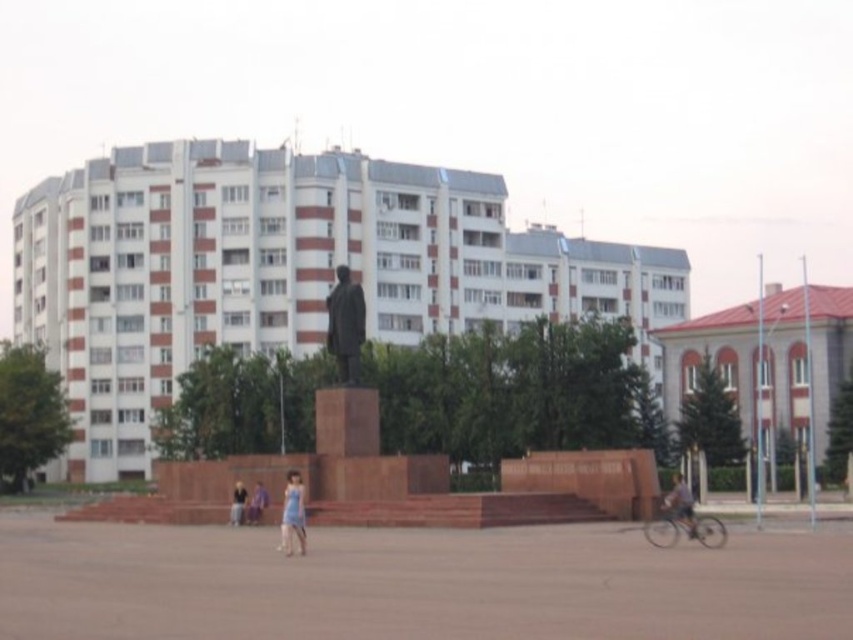
You are a photographer positioned at the statue. You want to capture both the blue fabric dress at lower center and the light blue dress at center in a single frame. What is the minimum focal length required to include both subjects in the photo?

The minimum focal length required to capture both the blue fabric dress at lower center and the light blue dress at center is determined by their distance apart. Since they are 4.62 meters apart, you would need a wide enough angle to cover this distance in the frame. A focal length of 35mm or lower would likely suffice for most cameras to include both subjects in the shot.

You are standing in the urban scene and want to determine which of the two points, point (288, 493) or point (677, 481), is nearer to you. Based on the description, which point is closer?

Point (288, 493) is closer to the viewer than point (677, 481).